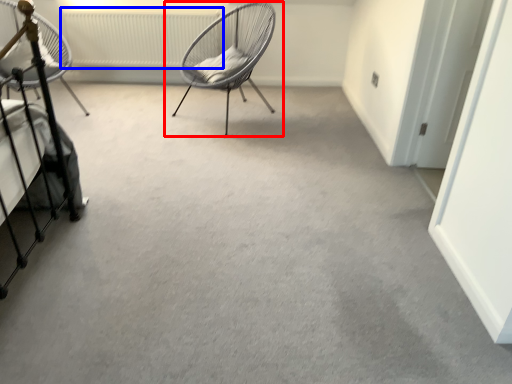
Question: Which object is closer to the camera taking this photo, chair (highlighted by a red box) or radiator (highlighted by a blue box)?

Choices:
 (A) chair
 (B) radiator

Answer: (A)